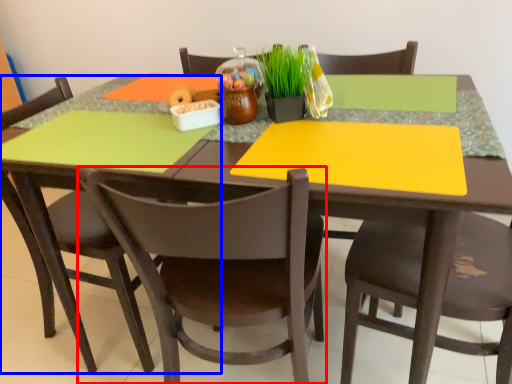
Question: Which object appears farthest to the camera in this image, chair (highlighted by a red box) or chair (highlighted by a blue box)?

Choices:
 (A) chair
 (B) chair

Answer: (B)